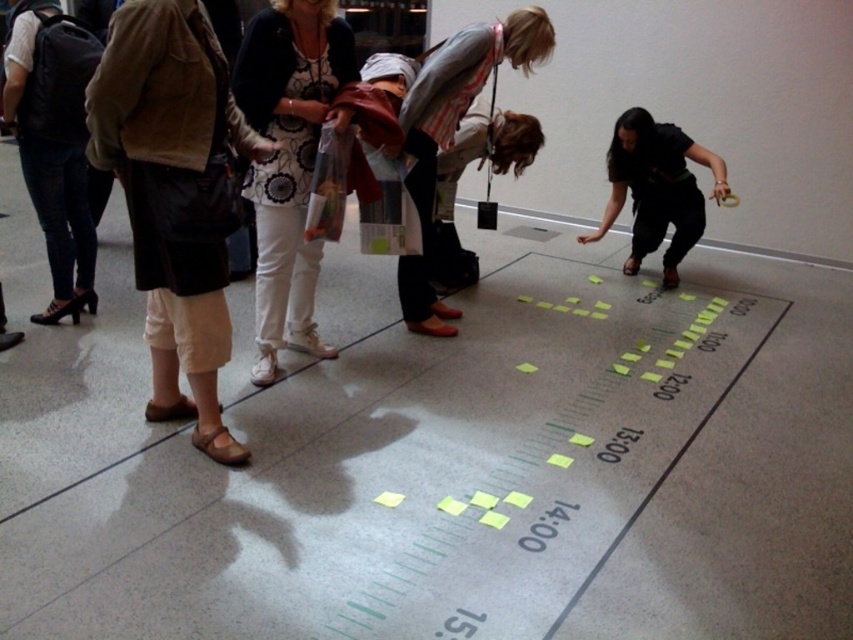
Question: Considering the relative positions of white cotton pants at center and striped fabric shirt at center in the image provided, where is white cotton pants at center located with respect to striped fabric shirt at center?

Choices:
 (A) left
 (B) right

Answer: (A)

Question: Which object appears closest to the camera in this image?

Choices:
 (A) white cotton pants at center
 (B) striped fabric shirt at center

Answer: (A)

Question: Is white cotton pants at center to the left of striped fabric shirt at center from the viewer's perspective?

Choices:
 (A) yes
 (B) no

Answer: (A)

Question: Can you confirm if white cotton pants at center is thinner than striped fabric shirt at center?

Choices:
 (A) no
 (B) yes

Answer: (B)

Question: Which object appears farthest from the camera in this image?

Choices:
 (A) white cotton pants at center
 (B) striped fabric shirt at center

Answer: (B)

Question: Which object is farther from the camera taking this photo?

Choices:
 (A) white cotton pants at center
 (B) striped fabric shirt at center

Answer: (B)